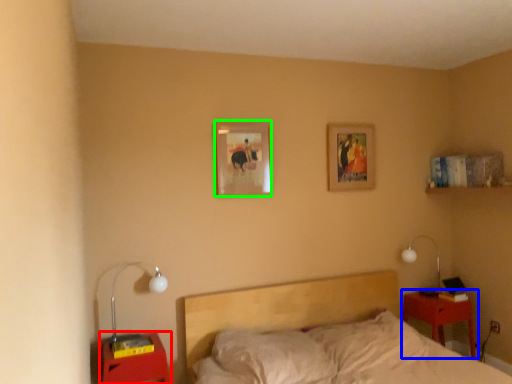
Question: Which object is the farthest from nightstand (highlighted by a red box)? Choose among these: nightstand (highlighted by a blue box) or picture frame (highlighted by a green box).

Choices:
 (A) nightstand
 (B) picture frame

Answer: (A)